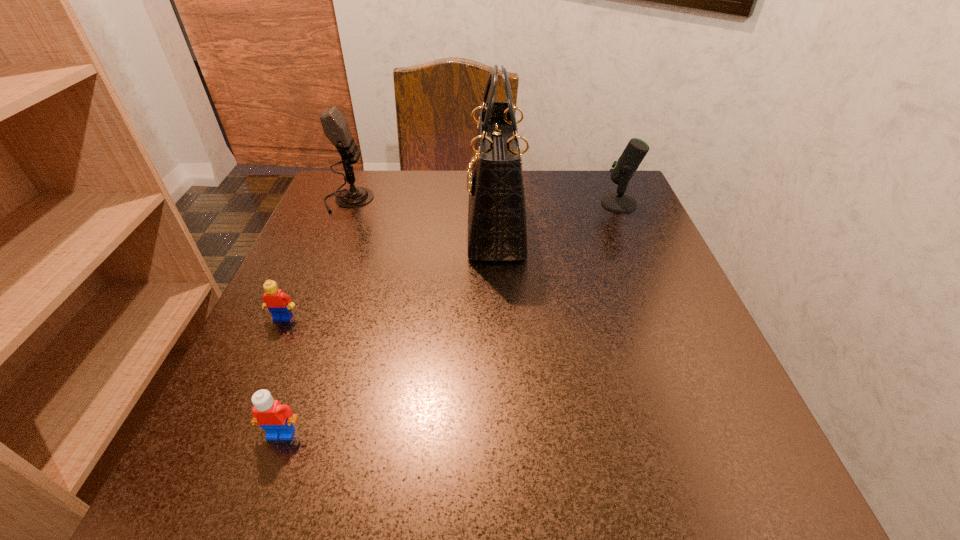
The image size is (960, 540). What are the coordinates of `object at the right edge` in the screenshot? It's located at (623, 169).

At what (x,y) coordinates should I click in order to perform the action: click on object that is at the far left corner. Please return your answer as a coordinate pair (x, y). This screenshot has width=960, height=540. Looking at the image, I should click on (336, 129).

Identify the location of object located in the near left corner section of the desktop. (277, 419).

Where is `object that is at the far right corner`? Image resolution: width=960 pixels, height=540 pixels. object that is at the far right corner is located at coordinates (623, 169).

Find the location of `vacant space at the far edge of the desktop`. vacant space at the far edge of the desktop is located at coordinates (531, 194).

Image resolution: width=960 pixels, height=540 pixels. Find the location of `vacant space at the left edge`. vacant space at the left edge is located at coordinates (334, 298).

In the image, there is a desktop. At what (x,y) coordinates should I click in order to perform the action: click on free space at the right edge. Please return your answer as a coordinate pair (x, y). Looking at the image, I should click on [594, 245].

Identify the location of free space at the far left corner of the desktop. Image resolution: width=960 pixels, height=540 pixels. (336, 170).

Locate an element on the screen. The width and height of the screenshot is (960, 540). free space at the far right corner of the desktop is located at coordinates (600, 206).

Find the location of a particular element. The height and width of the screenshot is (540, 960). free space at the near right corner of the desktop is located at coordinates click(706, 464).